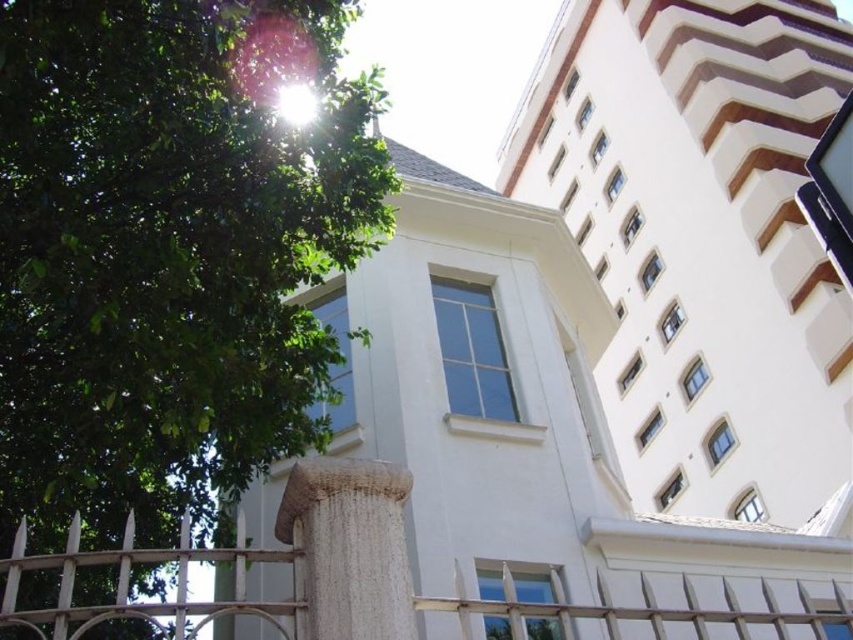
Question: Is white smooth building at center to the right of woven fabric pillar at lower center from the viewer's perspective?

Choices:
 (A) no
 (B) yes

Answer: (B)

Question: Among these points, which one is nearest to the camera?

Choices:
 (A) (416, 547)
 (B) (257, 605)
 (C) (331, 532)

Answer: (B)

Question: Which object is closer to the camera taking this photo?

Choices:
 (A) white smooth building at upper right
 (B) white smooth building at center

Answer: (B)

Question: Can you confirm if white smooth building at center is positioned to the left of white metal fence at lower center?

Choices:
 (A) yes
 (B) no

Answer: (B)

Question: Among these points, which one is farthest from the camera?

Choices:
 (A) (73, 632)
 (B) (370, 552)
 (C) (0, 250)
 (D) (341, 387)

Answer: (D)

Question: Can you confirm if white smooth building at upper right is thinner than white metal fence at lower center?

Choices:
 (A) yes
 (B) no

Answer: (B)